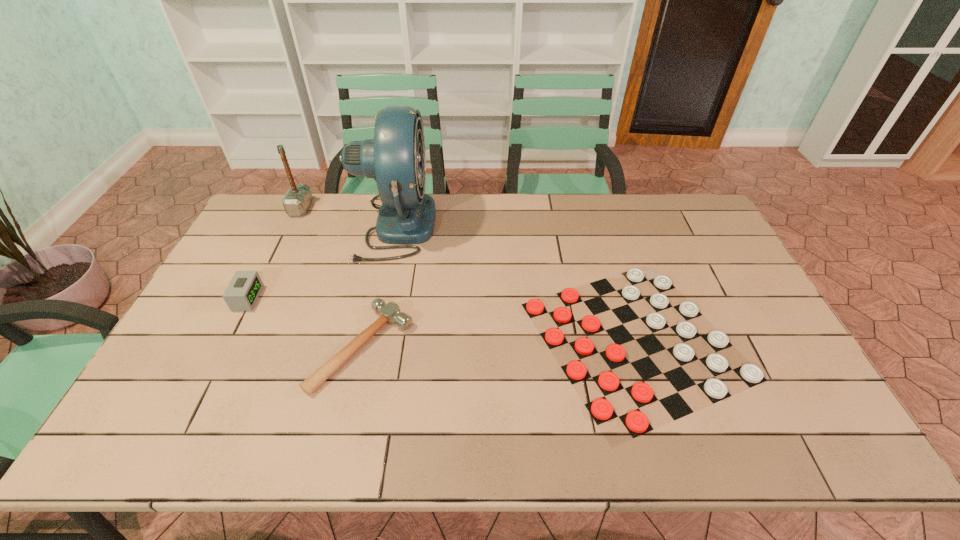
You are a GUI agent. You are given a task and a screenshot of the screen. Output one action in this format:
    pyautogui.click(x=<x>, y=<y>)
    Task: Click on the free space between the rightmost object and the shorter hammer
    This screenshot has width=960, height=540.
    Given the screenshot: What is the action you would take?
    pyautogui.click(x=499, y=343)

Identify the location of vacant area that lies between the third tallest object and the rightmost object. The image size is (960, 540). (442, 319).

The width and height of the screenshot is (960, 540). In order to click on free space that is in between the taller hammer and the alarm clock in this screenshot , I will do `click(275, 253)`.

Where is `free space between the farther hammer and the right hammer`? This screenshot has width=960, height=540. free space between the farther hammer and the right hammer is located at coordinates (331, 278).

The width and height of the screenshot is (960, 540). Identify the location of empty space between the right hammer and the second tallest object. (331, 278).

Where is `vacant area that lies between the second shortest object and the farther hammer`? The width and height of the screenshot is (960, 540). vacant area that lies between the second shortest object and the farther hammer is located at coordinates (331, 278).

At what (x,y) coordinates should I click in order to perform the action: click on the second closest object to the second shortest object. Please return your answer as a coordinate pair (x, y). Looking at the image, I should click on (241, 294).

What are the coordinates of `object that is the fourth closest to the fan` in the screenshot? It's located at (601, 410).

Identify the location of vacant position in the image that satisfies the following two spatial constraints: 1. on the back side of the checkerboard; 2. on the striking surface of the left hammer. The height and width of the screenshot is (540, 960). (594, 208).

The height and width of the screenshot is (540, 960). Identify the location of free location that satisfies the following two spatial constraints: 1. on the striking surface of the farther hammer; 2. on the right side of the rightmost object. point(237,340).